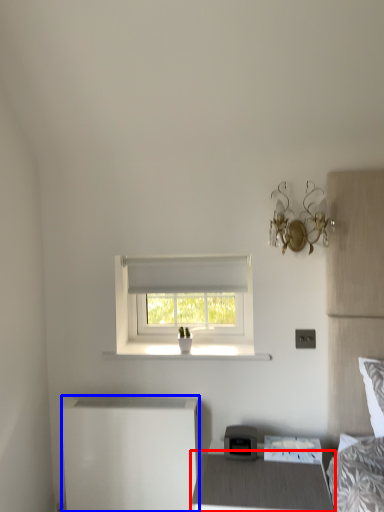
Question: Which object is further to the camera taking this photo, nightstand (highlighted by a red box) or changing table (highlighted by a blue box)?

Choices:
 (A) nightstand
 (B) changing table

Answer: (B)